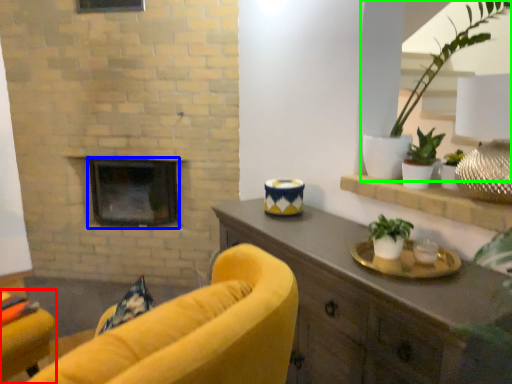
Question: Based on their relative distances, which object is farther from chair (highlighted by a red box)? Choose from fireplace (highlighted by a blue box) and houseplant (highlighted by a green box).

Choices:
 (A) fireplace
 (B) houseplant

Answer: (B)